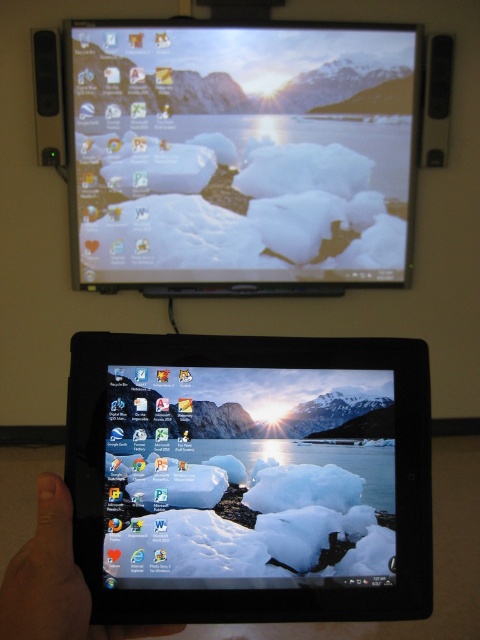
You are trying to reach the black plastic tablet at center while your hand is near the skinny finger at lower left. Can you grab it without moving your hand?

The black plastic tablet at center is to the right of the skinny finger at lower left, so you can reach it by moving your hand slightly to the right.

You are trying to place a small sticker on the matte plastic desktop at upper center without covering the skinny finger at lower left. Is this possible?

The matte plastic desktop at upper center is positioned over the skinny finger at lower left, so placing the sticker on the matte plastic desktop at upper center would not cover the skinny finger at lower left as they are separate objects.

You are a user trying to click on an icon on the tablet or small laptop screen being held in the foreground. The icon you want is at point coordinates point (x=382, y=221) and another icon is at point (x=36, y=556). Which icon is closer to the top edge of the screen?

The point (x=36, y=556) is closer to the top edge of the screen because its y coordinate is 0.077, which is lower than 0.796, meaning it is positioned higher up on the screen.